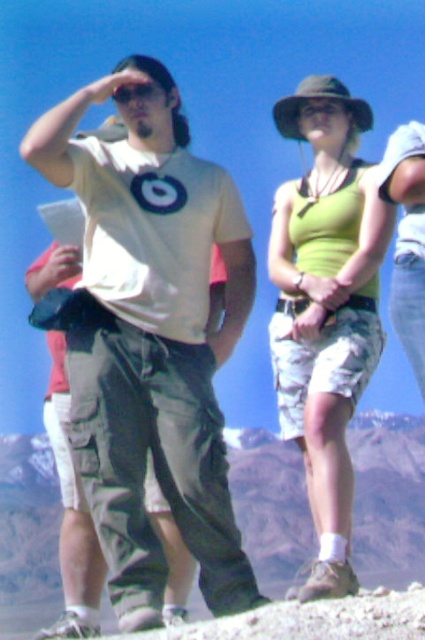
Question: Which point is closer to the camera taking this photo?

Choices:
 (A) (122, 97)
 (B) (379, 250)
 (C) (101, 531)
 (D) (5, 582)

Answer: (C)

Question: Can you confirm if matte khaki pants at center is thinner than green fabric tank top at center?

Choices:
 (A) no
 (B) yes

Answer: (A)

Question: Observing the image, what is the correct spatial positioning of green fabric tank top at center in reference to matte black sunglasses at upper left?

Choices:
 (A) left
 (B) right

Answer: (B)

Question: Is matte khaki pants at center closer to the viewer compared to matte black sunglasses at upper left?

Choices:
 (A) yes
 (B) no

Answer: (A)

Question: Which point is closer to the camera?

Choices:
 (A) (122, 84)
 (B) (87, 100)
 (C) (295, 452)
 (D) (303, 276)

Answer: (B)

Question: Which point is farther to the camera?

Choices:
 (A) green fabric tank top at center
 (B) matte khaki pants at center
 (C) gray rock formation at center
 (D) matte black sunglasses at upper left

Answer: (C)